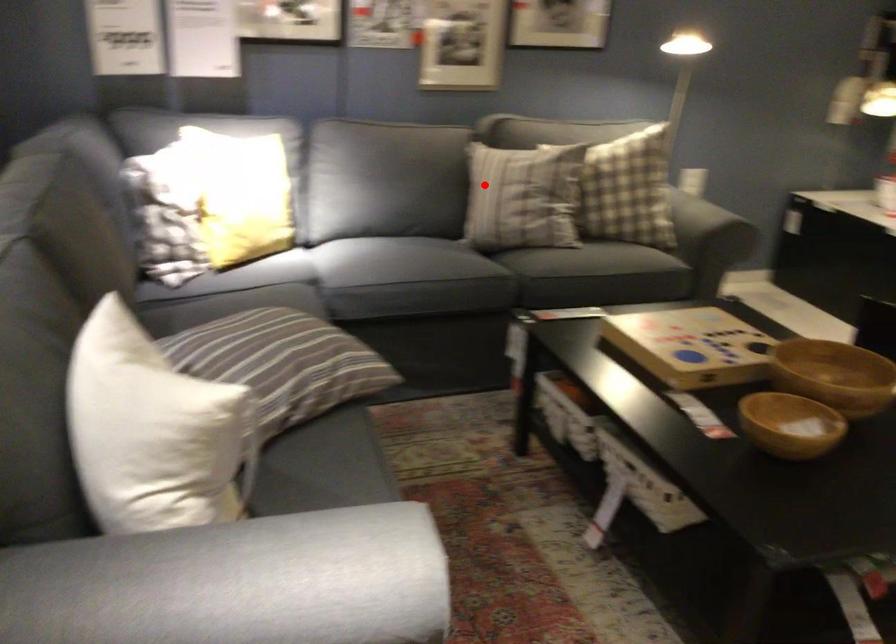
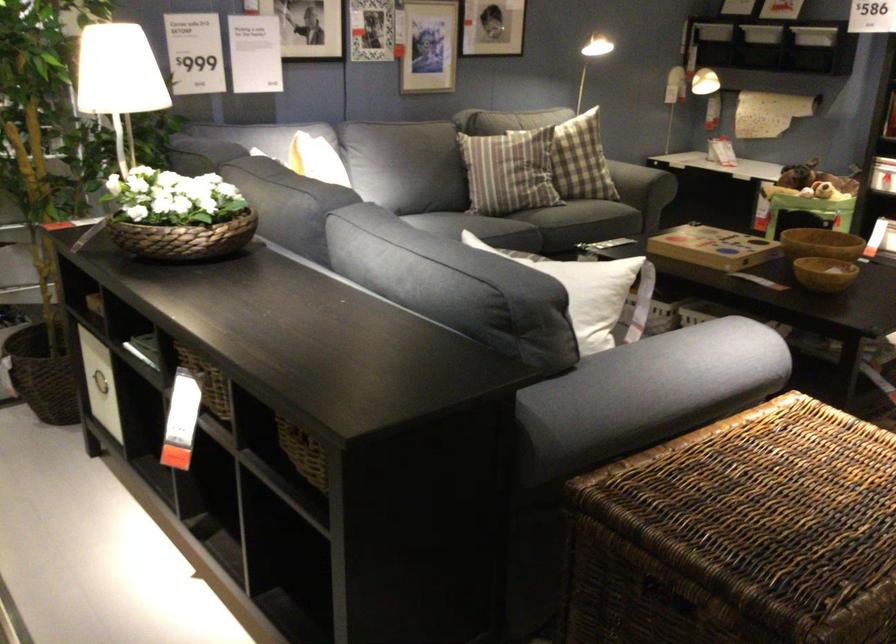
The point at the highlighted location is marked in the first image. Where is the corresponding point in the second image?

(507, 172)